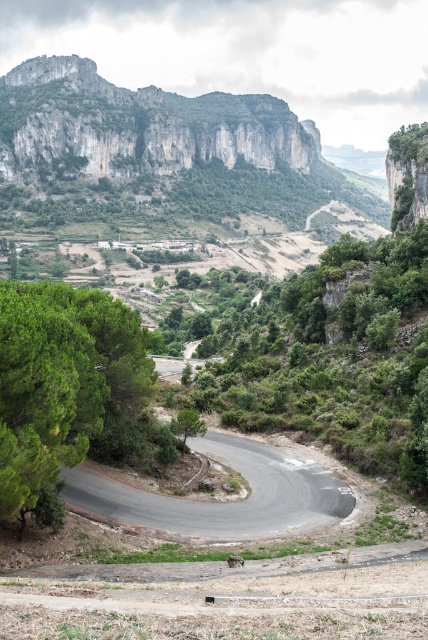
You are a hiker planning to take a photo of the rugged stone mountain at upper left and the green leafy tree at lower left. Which object should you position closer to the left edge of your camera frame to include both in the photo?

The rugged stone mountain at upper left should be positioned closer to the left edge of your camera frame because it is already on the left side of the green leafy tree at lower left.

You are a hiker planning to walk from the green leafy tree at lower left to the green leafy tree at center. The path between them is straight. Your backpack has a water capacity of 1 liter, and you consume 0.5 liters per kilometer. Can you make the journey without needing to refill?

The distance between the green leafy tree at lower left and the green leafy tree at center is 12.66 meters. Since 12.66 meters is approximately 0.01266 kilometers, you would consume about 0.00633 liters of water, which is well within your 1 liter capacity. Therefore, you can complete the journey without needing to refill.

You are a hiker planning to take a photo of the rugged stone mountain at upper left and the green leafy tree at center. Which object should you focus on first to ensure both are in the frame?

You should focus on the rugged stone mountain at upper left first because it is closer to you than the green leafy tree at center, so adjusting the frame to include it will also capture the tree in the background.